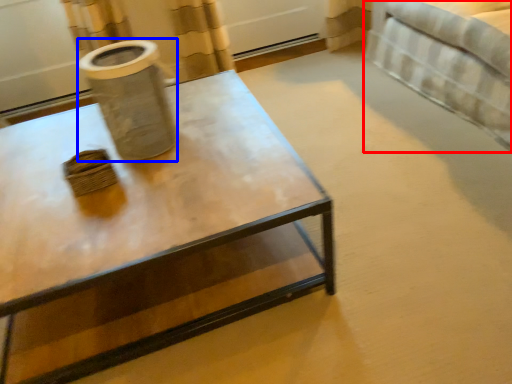
Question: Among these objects, which one is farthest to the camera, bed (highlighted by a red box) or vase (highlighted by a blue box)?

Choices:
 (A) bed
 (B) vase

Answer: (A)